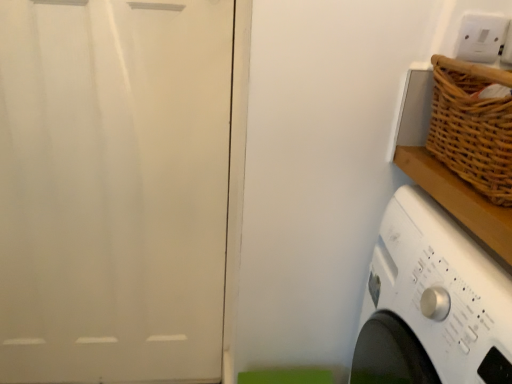
Question: Does white glossy screen door at left have a lesser height compared to woven brown basket at upper right?

Choices:
 (A) yes
 (B) no

Answer: (B)

Question: From the image's perspective, is white glossy screen door at left located beneath woven brown basket at upper right?

Choices:
 (A) no
 (B) yes

Answer: (B)

Question: Is white glossy screen door at left further to the viewer compared to woven brown basket at upper right?

Choices:
 (A) yes
 (B) no

Answer: (A)

Question: Considering the relative sizes of white glossy screen door at left and woven brown basket at upper right in the image provided, is white glossy screen door at left smaller than woven brown basket at upper right?

Choices:
 (A) yes
 (B) no

Answer: (B)

Question: Does white glossy screen door at left have a larger size compared to woven brown basket at upper right?

Choices:
 (A) yes
 (B) no

Answer: (A)

Question: In terms of width, does white plastic electric outlet at upper right look wider or thinner when compared to white glossy screen door at left?

Choices:
 (A) wide
 (B) thin

Answer: (B)

Question: Looking at the image, does white plastic electric outlet at upper right seem bigger or smaller compared to white glossy screen door at left?

Choices:
 (A) small
 (B) big

Answer: (A)

Question: From the image's perspective, is white plastic electric outlet at upper right above or below white glossy screen door at left?

Choices:
 (A) below
 (B) above

Answer: (B)

Question: In the image, is white plastic electric outlet at upper right on the left side or the right side of white glossy screen door at left?

Choices:
 (A) left
 (B) right

Answer: (B)

Question: In the image, is white glossy screen door at left positioned in front of or behind woven brown basket at upper right?

Choices:
 (A) behind
 (B) front

Answer: (A)

Question: From a real-world perspective, is white glossy screen door at left above or below woven brown basket at upper right?

Choices:
 (A) below
 (B) above

Answer: (A)

Question: Is point (78, 288) closer or farther from the camera than point (488, 177)?

Choices:
 (A) farther
 (B) closer

Answer: (A)

Question: From the image's perspective, relative to woven brown basket at upper right, is white glossy screen door at left above or below?

Choices:
 (A) below
 (B) above

Answer: (A)

Question: Do you think white glossy screen door at left is within white plastic electric outlet at upper right, or outside of it?

Choices:
 (A) inside
 (B) outside

Answer: (B)

Question: Considering the positions of point (193, 29) and point (458, 33), is point (193, 29) closer or farther from the camera than point (458, 33)?

Choices:
 (A) farther
 (B) closer

Answer: (A)